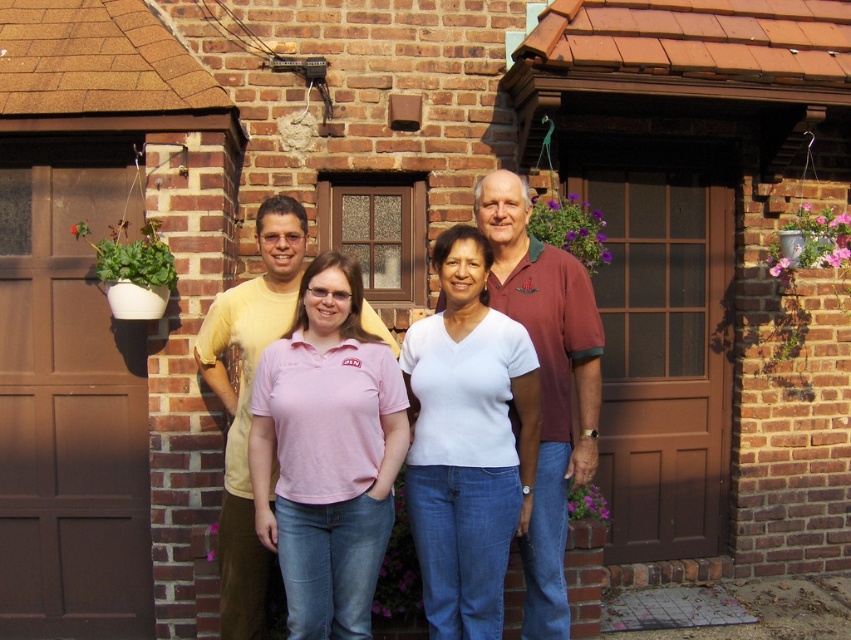
Question: In this image, where is pink cotton polo shirt at center located relative to pink cotton shirt at center?

Choices:
 (A) right
 (B) left

Answer: (B)

Question: Can you confirm if pink cotton polo shirt at center is positioned to the left of pink cotton shirt at center?

Choices:
 (A) yes
 (B) no

Answer: (A)

Question: Which point is farther to the camera?

Choices:
 (A) (570, 456)
 (B) (358, 392)
 (C) (466, 250)

Answer: (A)

Question: Among these points, which one is nearest to the camera?

Choices:
 (A) (558, 420)
 (B) (465, 461)

Answer: (B)

Question: Can you confirm if pink cotton polo shirt at center is wider than white matte shirt at center?

Choices:
 (A) no
 (B) yes

Answer: (B)

Question: Which of the following is the farthest from the observer?

Choices:
 (A) white matte shirt at center
 (B) pink cotton polo shirt at center
 (C) pink cotton shirt at center

Answer: (C)